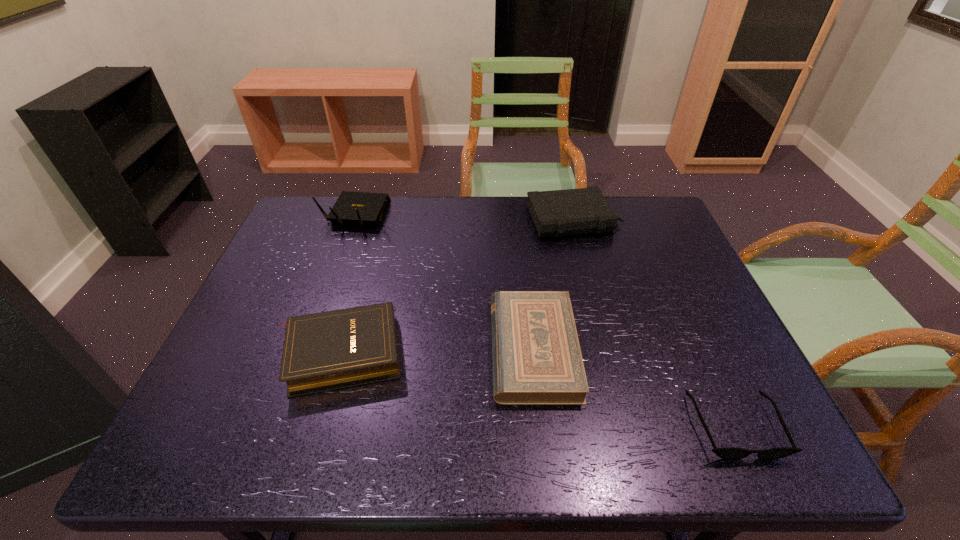
Where is `free space that satisfies the following two spatial constraints: 1. on the front side of the farthest Bible; 2. on the spine side of the shortest Bible`? This screenshot has width=960, height=540. free space that satisfies the following two spatial constraints: 1. on the front side of the farthest Bible; 2. on the spine side of the shortest Bible is located at coordinates (609, 349).

You are a GUI agent. You are given a task and a screenshot of the screen. Output one action in this format:
    pyautogui.click(x=<x>, y=<y>)
    Task: Click on the vacant area that satisfies the following two spatial constraints: 1. on the back side of the leftmost Bible; 2. on the right side of the farthest Bible
    The height and width of the screenshot is (540, 960).
    Given the screenshot: What is the action you would take?
    pyautogui.click(x=378, y=220)